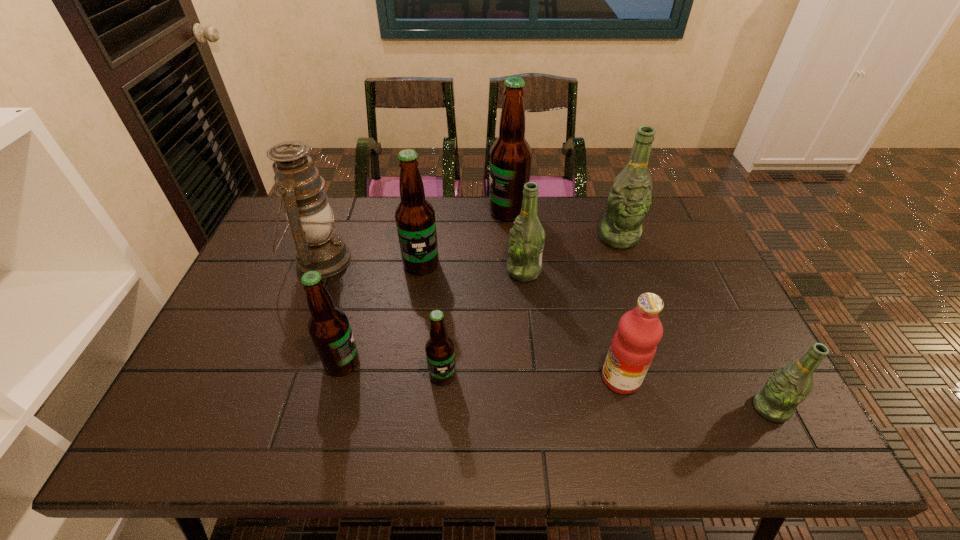
Choose which green beer bottle is the second nearest neighbor to the fruit juice. Please provide its 2D coordinates. Your answer should be formatted as a tuple, i.e. [(x, y)], where the tuple contains the x and y coordinates of a point satisfying the conditions above.

[(526, 241)]

Image resolution: width=960 pixels, height=540 pixels. In order to click on free space that satisfies the following two spatial constraints: 1. on the label of the biggest brown beer bottle; 2. on the label of the second beer bottle from left to right in this screenshot , I will do `click(512, 264)`.

Find the location of `free location that satisfies the following two spatial constraints: 1. on the surface of the farthest green beer bottle; 2. on the surface of the second nearest green beer bottle`. free location that satisfies the following two spatial constraints: 1. on the surface of the farthest green beer bottle; 2. on the surface of the second nearest green beer bottle is located at coordinates point(630,271).